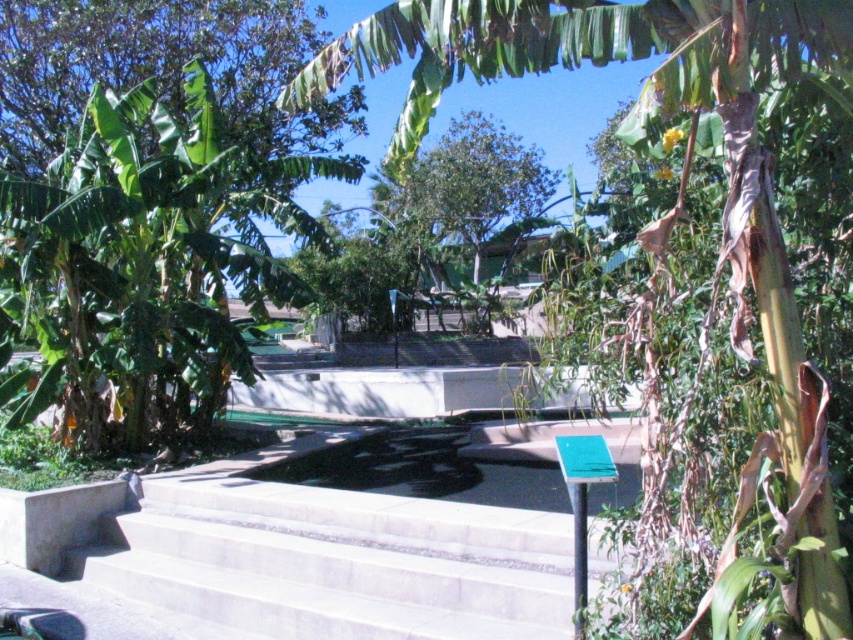
How much distance is there between concrete stairs at center and green leafy banana tree at center?

They are 9.18 feet apart.

Does concrete stairs at center have a lesser width compared to green leafy banana tree at center?

Incorrect, concrete stairs at center's width is not less than green leafy banana tree at center's.

Does point (405, 572) come in front of point (474, 67)?

That is False.

Image resolution: width=853 pixels, height=640 pixels. Find the location of `concrete stairs at center`. concrete stairs at center is located at coordinates (335, 563).